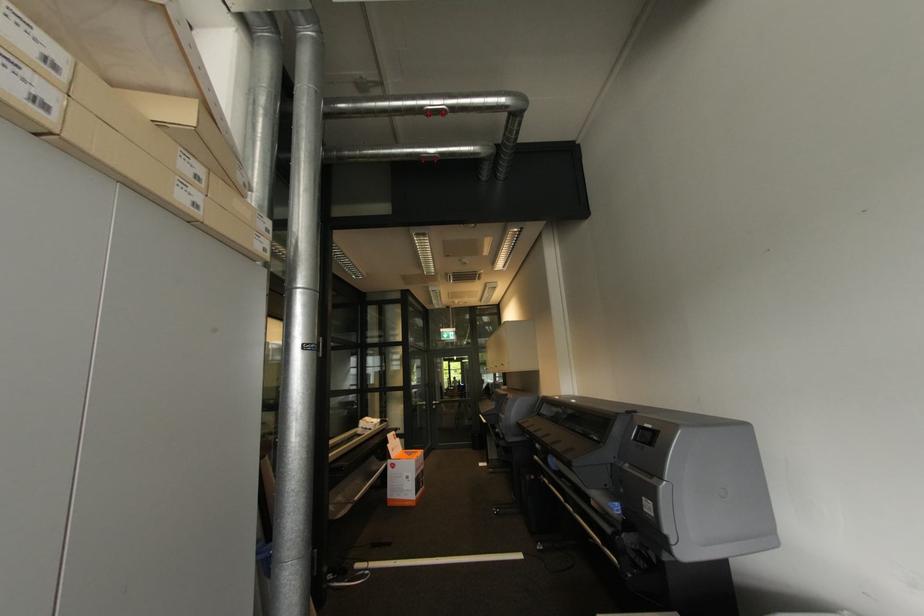
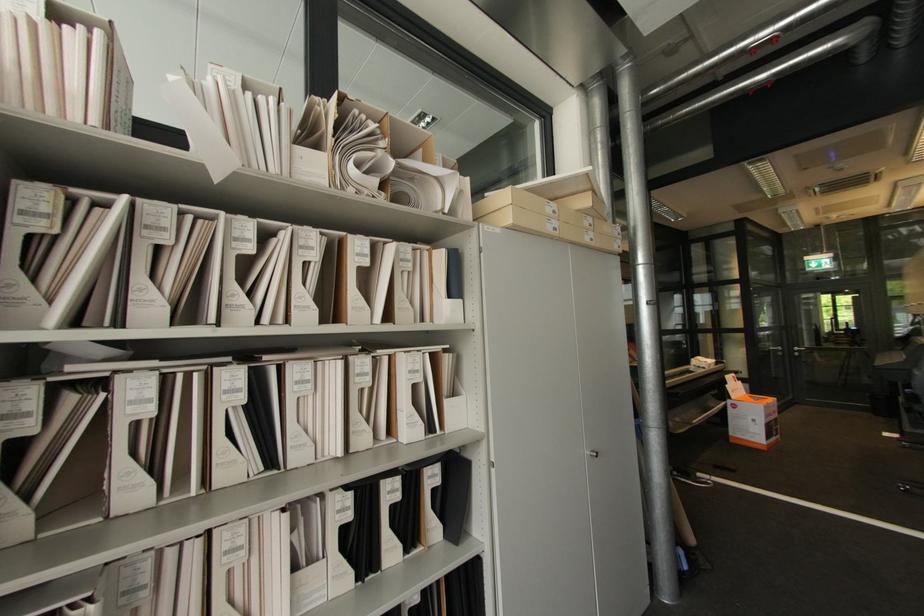
Where in the second image is the point corresponding to [438,407] from the first image?

(800, 354)